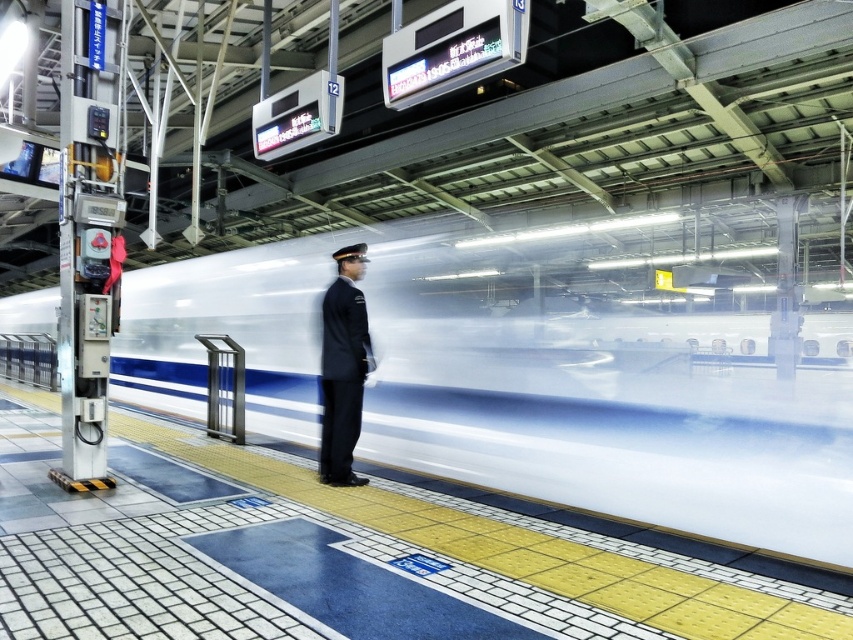
Is yellow tactile paving at center bigger than dark blue uniform at center?

No.

Can you confirm if yellow tactile paving at center is positioned to the right of dark blue uniform at center?

Yes, yellow tactile paving at center is to the right of dark blue uniform at center.

Where is `yellow tactile paving at center`? yellow tactile paving at center is located at coordinates (517, 548).

Does point (135, 314) come behind point (335, 285)?

Yes, it is behind point (335, 285).

Does white glossy train at center have a greater width compared to dark blue uniform at center?

Yes.

The width and height of the screenshot is (853, 640). Identify the location of white glossy train at center. (523, 387).

At what (x,y) coordinates should I click in order to perform the action: click on white glossy train at center. Please return your answer as a coordinate pair (x, y). Looking at the image, I should click on (523, 387).

Who is taller, white glossy train at center or yellow tactile paving at center?

Standing taller between the two is white glossy train at center.

Does white glossy train at center lie in front of yellow tactile paving at center?

No, white glossy train at center is further to the viewer.

Locate an element on the screen. The image size is (853, 640). white glossy train at center is located at coordinates (523, 387).